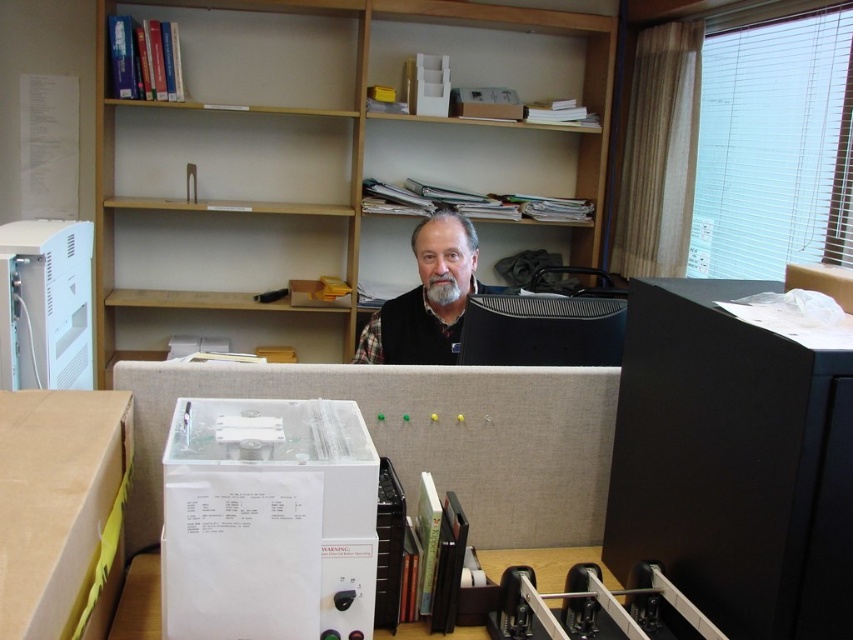
You are an office worker who needs to place a new item on the tallest object in the office. Which object should you choose between the light wood bookshelf at upper center and the white plastic box at lower left?

The light wood bookshelf at upper center has a greater height compared to the white plastic box at lower left, so you should place the item on the light wood bookshelf at upper center.

You are organizing a small office space and need to place a new item on the desk. The item requires a surface area larger than the white plastic box at lower left. Can the light wood bookshelf at upper center accommodate this item based on their sizes?

The light wood bookshelf at upper center is wider than the white plastic box at lower left, so it can accommodate an item requiring a larger surface area than the white plastic box at lower left.